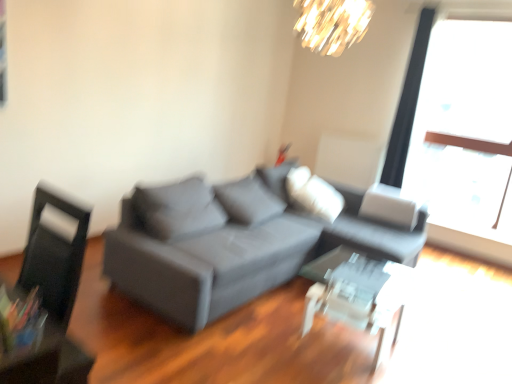
Question: Is black leather swivel chair at left thinner than matte gray couch at center?

Choices:
 (A) no
 (B) yes

Answer: (B)

Question: Is black leather swivel chair at left smaller than matte gray couch at center?

Choices:
 (A) no
 (B) yes

Answer: (B)

Question: Is black leather swivel chair at left closer to the viewer compared to matte gray couch at center?

Choices:
 (A) yes
 (B) no

Answer: (A)

Question: Is matte gray couch at center completely or partially inside black leather swivel chair at left?

Choices:
 (A) no
 (B) yes

Answer: (A)

Question: Is black leather swivel chair at left further to the viewer compared to matte gray couch at center?

Choices:
 (A) yes
 (B) no

Answer: (B)

Question: Based on their sizes in the image, would you say matte gray couch at center is bigger or smaller than shiny gold chandelier at upper center?

Choices:
 (A) small
 (B) big

Answer: (B)

Question: In terms of width, does matte gray couch at center look wider or thinner when compared to shiny gold chandelier at upper center?

Choices:
 (A) wide
 (B) thin

Answer: (A)

Question: Is matte gray couch at center to the left or to the right of shiny gold chandelier at upper center in the image?

Choices:
 (A) right
 (B) left

Answer: (B)

Question: From a real-world perspective, is matte gray couch at center positioned above or below shiny gold chandelier at upper center?

Choices:
 (A) above
 (B) below

Answer: (B)

Question: From the image's perspective, is transparent glass window at upper right above or below black leather swivel chair at left?

Choices:
 (A) below
 (B) above

Answer: (B)

Question: From their relative heights in the image, would you say transparent glass window at upper right is taller or shorter than black leather swivel chair at left?

Choices:
 (A) tall
 (B) short

Answer: (A)

Question: From a real-world perspective, relative to black leather swivel chair at left, is transparent glass window at upper right vertically above or below?

Choices:
 (A) below
 (B) above

Answer: (B)

Question: Is transparent glass window at upper right in front of or behind black leather swivel chair at left in the image?

Choices:
 (A) behind
 (B) front

Answer: (A)

Question: Is transparent glass table at center spatially inside black leather swivel chair at left, or outside of it?

Choices:
 (A) outside
 (B) inside

Answer: (A)

Question: In the image, is transparent glass table at center positioned in front of or behind black leather swivel chair at left?

Choices:
 (A) behind
 (B) front

Answer: (A)